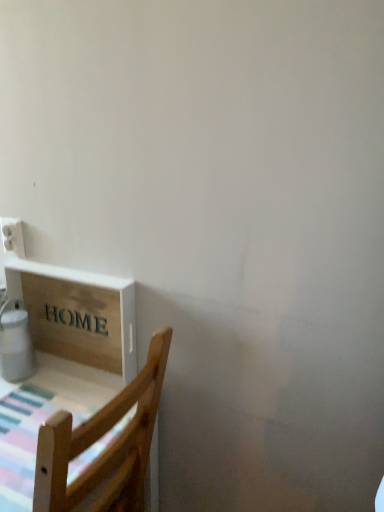
I want to click on vacant space in front of wooden sign at lower left, so pyautogui.click(x=52, y=401).